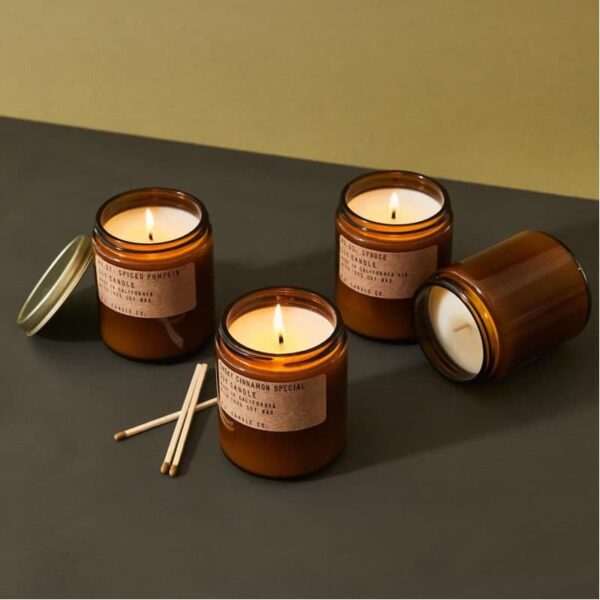
The width and height of the screenshot is (600, 600). I want to click on the back of candle, so click(507, 270).